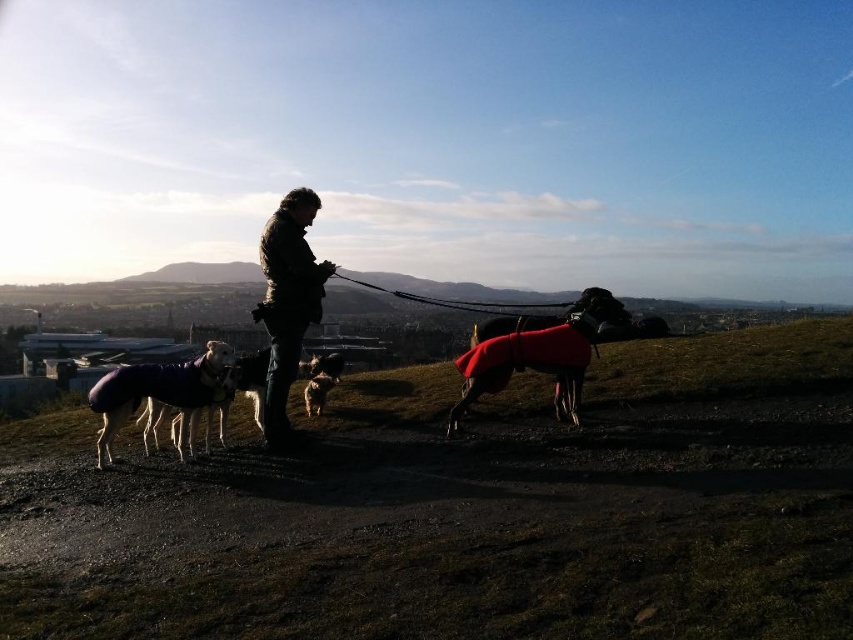
Between smooth grass hill at center and fluffy brown dog at center, which one appears on the left side from the viewer's perspective?

From the viewer's perspective, fluffy brown dog at center appears more on the left side.

Is smooth grass hill at center positioned behind fluffy brown dog at center?

No, smooth grass hill at center is closer to the viewer.

What do you see at coordinates (468, 512) in the screenshot?
I see `smooth grass hill at center` at bounding box center [468, 512].

Identify the location of smooth grass hill at center. This screenshot has width=853, height=640. (468, 512).

Who is taller, soft purple coat at lower left or purple fleece coat at lower left?

soft purple coat at lower left is taller.

Who is more forward, (212, 387) or (157, 412)?

Point (212, 387) is in front.

Locate an element on the screen. The height and width of the screenshot is (640, 853). soft purple coat at lower left is located at coordinates (160, 394).

Can you confirm if purple fleece coat at lower left is positioned to the left of shiny black dog at center?

Correct, you'll find purple fleece coat at lower left to the left of shiny black dog at center.

Is point (265, 360) positioned behind point (244, 365)?

Yes, it is.

At what (x,y) coordinates should I click in order to perform the action: click on purple fleece coat at lower left. Please return your answer as a coordinate pair (x, y). The image size is (853, 640). Looking at the image, I should click on (248, 380).